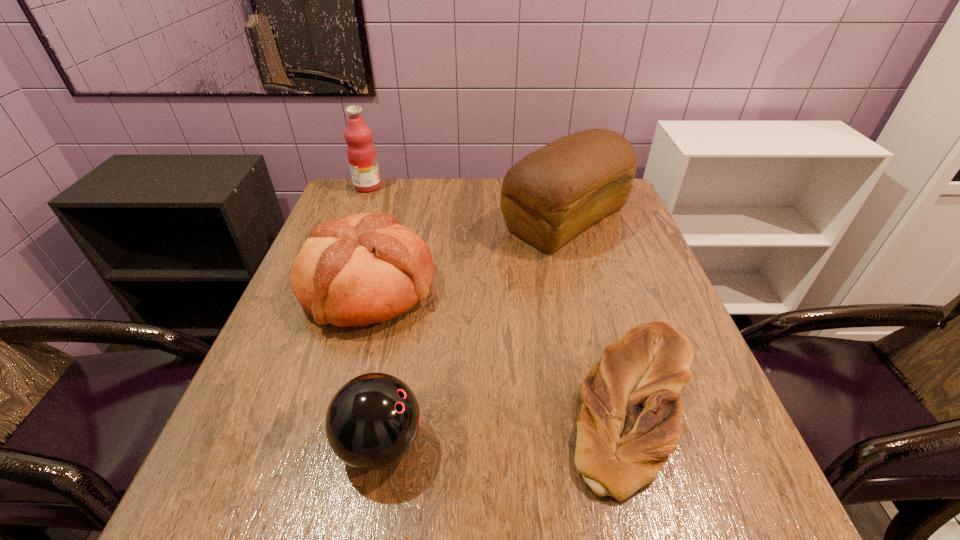
Identify the location of fruit juice. The width and height of the screenshot is (960, 540). (361, 152).

I want to click on the tallest bread, so click(x=551, y=195).

This screenshot has height=540, width=960. I want to click on the leftmost bread, so click(x=367, y=268).

Locate an element on the screen. The height and width of the screenshot is (540, 960). bowling ball is located at coordinates (372, 421).

You are a GUI agent. You are given a task and a screenshot of the screen. Output one action in this format:
    pyautogui.click(x=<x>, y=<y>)
    Task: Click on the shortest object
    
    Given the screenshot: What is the action you would take?
    pyautogui.click(x=631, y=418)

Where is `vacant space located on the label of the fruit juice`? Image resolution: width=960 pixels, height=540 pixels. vacant space located on the label of the fruit juice is located at coordinates (399, 187).

You are a GUI agent. You are given a task and a screenshot of the screen. Output one action in this format:
    pyautogui.click(x=<x>, y=<y>)
    Task: Click on the free space located on the left of the tallest bread
    Image resolution: width=960 pixels, height=540 pixels.
    Given the screenshot: What is the action you would take?
    pyautogui.click(x=446, y=219)

Find the location of `vacant space situated 0.360m on the right of the second shortest bread`. vacant space situated 0.360m on the right of the second shortest bread is located at coordinates pos(588,287).

I want to click on free region located on the surface of the bowling ball near the finger holes, so click(x=647, y=444).

This screenshot has width=960, height=540. In order to click on free region located 0.150m on the left of the shortest object in this screenshot , I will do click(x=482, y=405).